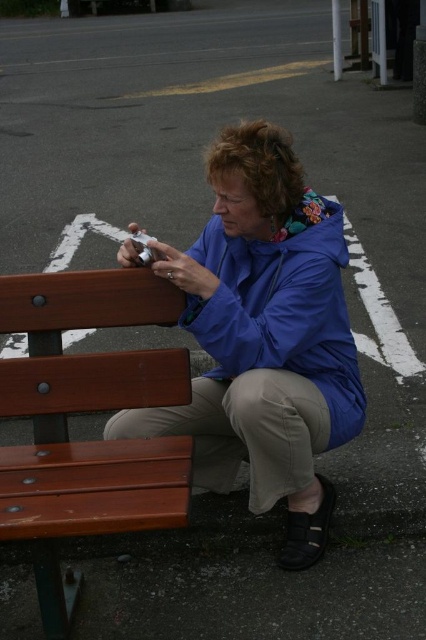
Describe the element at coordinates (264, 337) in the screenshot. I see `blue fabric jacket at center` at that location.

At what (x,y) coordinates should I click in order to perform the action: click on blue fabric jacket at center. Please return your answer as a coordinate pair (x, y). The width and height of the screenshot is (426, 640). Looking at the image, I should click on coord(264,337).

Is blue fabric jacket at center taller than blue matte jacket at center?

Correct, blue fabric jacket at center is much taller as blue matte jacket at center.

Can you confirm if blue fabric jacket at center is positioned to the left of blue matte jacket at center?

Correct, you'll find blue fabric jacket at center to the left of blue matte jacket at center.

What do you see at coordinates (264, 337) in the screenshot? I see `blue fabric jacket at center` at bounding box center [264, 337].

This screenshot has height=640, width=426. Identify the location of blue fabric jacket at center. (264, 337).

Does wooden bench at lower left come in front of blue matte jacket at center?

Yes, wooden bench at lower left is closer to the viewer.

How far apart are wooden bench at lower left and blue matte jacket at center?

16.66 inches

Where is `wooden bench at lower left`? This screenshot has height=640, width=426. wooden bench at lower left is located at coordinates (89, 412).